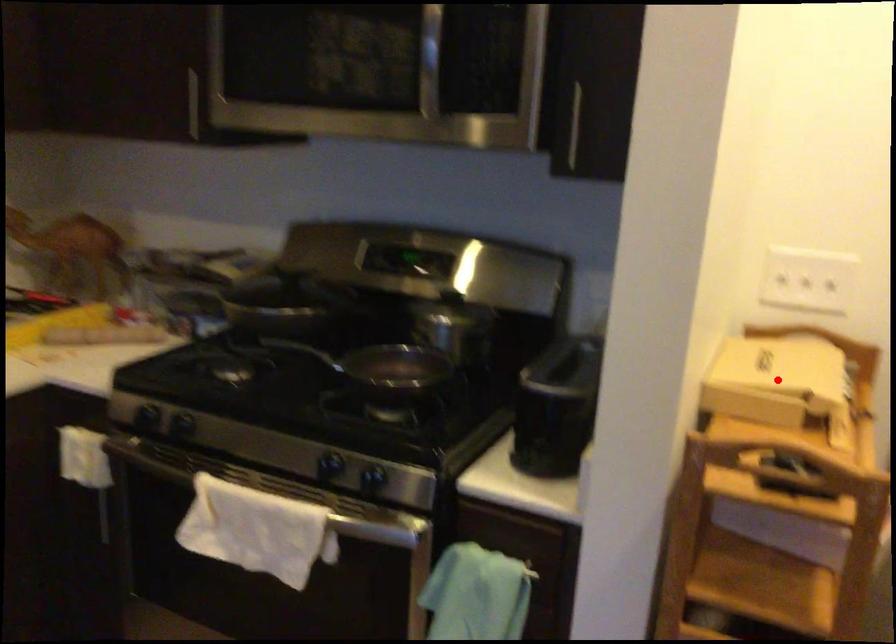
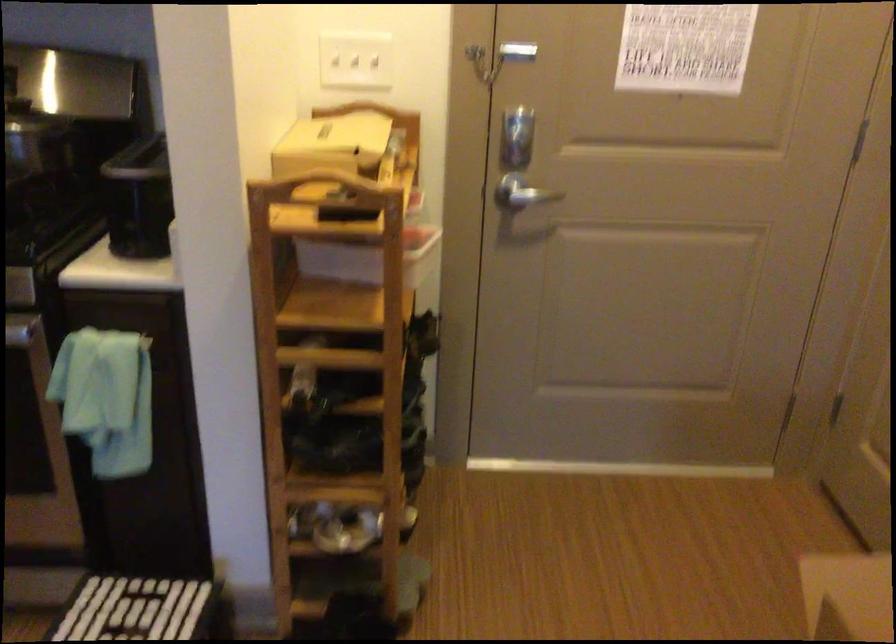
Where in the second image is the point corresponding to the highlighted location from the first image?

(331, 144)